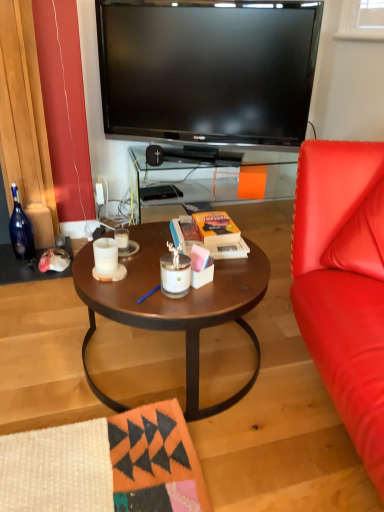
The width and height of the screenshot is (384, 512). I want to click on free location in front of white matte candle at center, which appears as the first coffee cup when viewed from the front, so click(x=119, y=290).